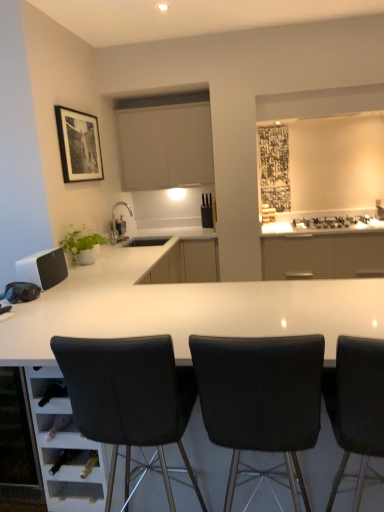
What do you see at coordinates (331, 222) in the screenshot? I see `black matte gas stove at upper right` at bounding box center [331, 222].

The height and width of the screenshot is (512, 384). What do you see at coordinates (79, 145) in the screenshot? I see `black matte picture frame at upper left` at bounding box center [79, 145].

Locate an element on the screen. black fabric chair at center, the second chair viewed from the left is located at coordinates (261, 400).

This screenshot has height=512, width=384. What do you see at coordinates (43, 268) in the screenshot?
I see `matte black speaker at left` at bounding box center [43, 268].

Describe the element at coordinates (356, 405) in the screenshot. This screenshot has height=512, width=384. I see `black leather chair at center, the 3th chair from the left` at that location.

At what (x,y) coordinates should I click in order to perform the action: click on black matte gas stove at upper right. Please return your answer as a coordinate pair (x, y). The height and width of the screenshot is (512, 384). Looking at the image, I should click on (331, 222).

Is point (149, 423) closer or farther from the camera than point (265, 338)?

Point (149, 423) appears to be farther away from the viewer than point (265, 338).

Which is more to the right, black leather chair at center, which ranks as the first chair in left-to-right order, or black fabric chair at center, placed as the 2th chair when sorted from right to left?

Positioned to the right is black fabric chair at center, placed as the 2th chair when sorted from right to left.

Between black leather chair at center, which is the 3th chair in right-to-left order, and black fabric chair at center, placed as the 2th chair when sorted from right to left, which one has larger size?

Bigger between the two is black leather chair at center, which is the 3th chair in right-to-left order.

From the image's perspective, is black leather chair at center, which ranks as the first chair in left-to-right order, above or below black fabric chair at center, placed as the 2th chair when sorted from right to left?

From the image's perspective, black leather chair at center, which ranks as the first chair in left-to-right order, appears below black fabric chair at center, placed as the 2th chair when sorted from right to left.

This screenshot has width=384, height=512. What are the coordinates of `kitchen appliance located underneath the black matte picture frame at upper left (from a real-world perspective)` in the screenshot? It's located at (331, 222).

Which is closer, (299, 229) or (94, 131)?

Point (299, 229) appears to be farther away from the viewer than point (94, 131).

From a real-world perspective, does black matte gas stove at upper right stand above black matte picture frame at upper left?

No, from a real-world perspective, black matte gas stove at upper right is not above black matte picture frame at upper left.

Is black leather chair at center, which ranks as the first chair in left-to-right order, positioned in front of matte black speaker at left?

Yes, it is.

Can you see black leather chair at center, which is the 3th chair in right-to-left order, touching matte black speaker at left?

No, black leather chair at center, which is the 3th chair in right-to-left order, is not in contact with matte black speaker at left.

From the picture: Is black leather chair at center, which ranks as the first chair in left-to-right order, wider than matte black speaker at left?

Correct, the width of black leather chair at center, which ranks as the first chair in left-to-right order, exceeds that of matte black speaker at left.

From the image's perspective, relative to matte black speaker at left, is black leather chair at center, which ranks as the first chair in left-to-right order, above or below?

Clearly, from the image's perspective, black leather chair at center, which ranks as the first chair in left-to-right order, is below matte black speaker at left.

Is black fabric chair at center, the second chair viewed from the left, not inside black leather chair at center, which ranks as the first chair in left-to-right order?

black fabric chair at center, the second chair viewed from the left, lies outside black leather chair at center, which ranks as the first chair in left-to-right order,'s area.

From a real-world perspective, between black fabric chair at center, the second chair viewed from the left, and black leather chair at center, which ranks as the first chair in left-to-right order, who is vertically lower?

From a 3D spatial view, black leather chair at center, which ranks as the first chair in left-to-right order, is below.

Considering the sizes of objects black fabric chair at center, the second chair viewed from the left, and black leather chair at center, which ranks as the first chair in left-to-right order, in the image provided, who is bigger, black fabric chair at center, the second chair viewed from the left, or black leather chair at center, which ranks as the first chair in left-to-right order,?

With larger size is black leather chair at center, which ranks as the first chair in left-to-right order.

From the image's perspective, is black fabric chair at center, the second chair viewed from the left, located beneath black leather chair at center, which is the 3th chair in right-to-left order?

No.

From a real-world perspective, which object stands above the other?

black matte picture frame at upper left.

Identify the location of picture frame above the black fabric chair at center, placed as the 2th chair when sorted from right to left (from the image's perspective). The width and height of the screenshot is (384, 512). (79, 145).

Would you consider black matte picture frame at upper left to be distant from black fabric chair at center, the second chair viewed from the left?

black matte picture frame at upper left is positioned a significant distance from black fabric chair at center, the second chair viewed from the left.

Is matte beige cabinet at upper center bigger or smaller than black matte gas stove at upper right?

Clearly, matte beige cabinet at upper center is larger in size than black matte gas stove at upper right.

From the image's perspective, which is below, matte beige cabinet at upper center or black matte gas stove at upper right?

black matte gas stove at upper right is shown below in the image.

Where is `cabinetry that appears above the black matte gas stove at upper right (from a real-world perspective)`? cabinetry that appears above the black matte gas stove at upper right (from a real-world perspective) is located at coordinates (166, 146).

Can you tell me how much matte beige cabinet at upper center and black matte gas stove at upper right differ in facing direction?

The angular difference between matte beige cabinet at upper center and black matte gas stove at upper right is 0.273 degrees.

From the image's perspective, relative to matte black speaker at left, is black leather chair at center, the 3th chair from the left, above or below?

Clearly, from the image's perspective, black leather chair at center, the 3th chair from the left, is below matte black speaker at left.

Considering the sizes of objects black leather chair at center, which is the 1th chair from right to left, and matte black speaker at left in the image provided, who is smaller, black leather chair at center, which is the 1th chair from right to left, or matte black speaker at left?

matte black speaker at left.

Identify the location of appliance behind the black leather chair at center, the 3th chair from the left. The image size is (384, 512). (43, 268).

From a real-world perspective, is black leather chair at center, which is the 1th chair from right to left, above or below matte black speaker at left?

From a real-world perspective, black leather chair at center, which is the 1th chair from right to left, is physically below matte black speaker at left.

From the image's perspective, count 1st chairs upward from the black leather chair at center, which is the 3th chair in right-to-left order, and point to it. Please provide its 2D coordinates.

[(261, 400)]

I want to click on kitchen appliance on the right side of black matte picture frame at upper left, so click(x=331, y=222).

Estimate the real-world distances between objects in this image. Which object is further from black matte picture frame at upper left, white glossy table at center or matte beige cabinet at upper center?

white glossy table at center.

Estimate the real-world distances between objects in this image. Which object is closer to matte beige cabinet at upper center, black leather chair at center, which ranks as the first chair in left-to-right order, or white glossy table at center?

white glossy table at center is positioned closer to the anchor matte beige cabinet at upper center.

From the image, which object appears to be nearer to matte black speaker at left, black fabric chair at center, the second chair viewed from the left, or white glossy table at center?

Based on the image, white glossy table at center appears to be nearer to matte black speaker at left.

Estimate the real-world distances between objects in this image. Which object is further from matte beige cabinet at upper center, black matte gas stove at upper right or black leather chair at center, which ranks as the first chair in left-to-right order?

The object further to matte beige cabinet at upper center is black leather chair at center, which ranks as the first chair in left-to-right order.

When comparing their distances from white glossy table at center, does matte black speaker at left or black fabric chair at center, placed as the 2th chair when sorted from right to left, seem further?

The object further to white glossy table at center is matte black speaker at left.

Estimate the real-world distances between objects in this image. Which object is closer to black leather chair at center, the 3th chair from the left, black matte picture frame at upper left or matte black speaker at left?

Based on the image, matte black speaker at left appears to be nearer to black leather chair at center, the 3th chair from the left.

Looking at this image, looking at the image, which one is located further to black leather chair at center, which is the 1th chair from right to left, white glossy table at center or matte beige cabinet at upper center?

Based on the image, matte beige cabinet at upper center appears to be further to black leather chair at center, which is the 1th chair from right to left.

Based on their spatial positions, is black matte gas stove at upper right or black fabric chair at center, the second chair viewed from the left, closer to white glossy table at center?

black fabric chair at center, the second chair viewed from the left, is closer to white glossy table at center.

Find the location of a particular element. Image resolution: width=384 pixels, height=512 pixels. table located between matte black speaker at left and black leather chair at center, the 3th chair from the left, in the left-right direction is located at coordinates pyautogui.click(x=181, y=311).

You are a GUI agent. You are given a task and a screenshot of the screen. Output one action in this format:
    pyautogui.click(x=<x>, y=<y>)
    Task: Click on the appliance located between black leather chair at center, which ranks as the first chair in left-to-right order, and black matte picture frame at upper left in the depth direction
    The width and height of the screenshot is (384, 512).
    Given the screenshot: What is the action you would take?
    coord(43,268)

I want to click on chair between black fabric chair at center, the second chair viewed from the left, and black matte gas stove at upper right, along the z-axis, so click(x=129, y=397).

In order to click on table positioned between black leather chair at center, which is the 3th chair in right-to-left order, and matte beige cabinet at upper center from near to far in this screenshot , I will do `click(181, 311)`.